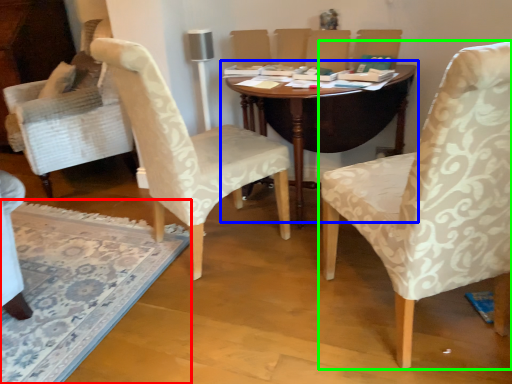
Question: Which object is positioned farthest from mat (highlighted by a red box)? Select from table (highlighted by a blue box) and chair (highlighted by a green box).

Choices:
 (A) table
 (B) chair

Answer: (B)